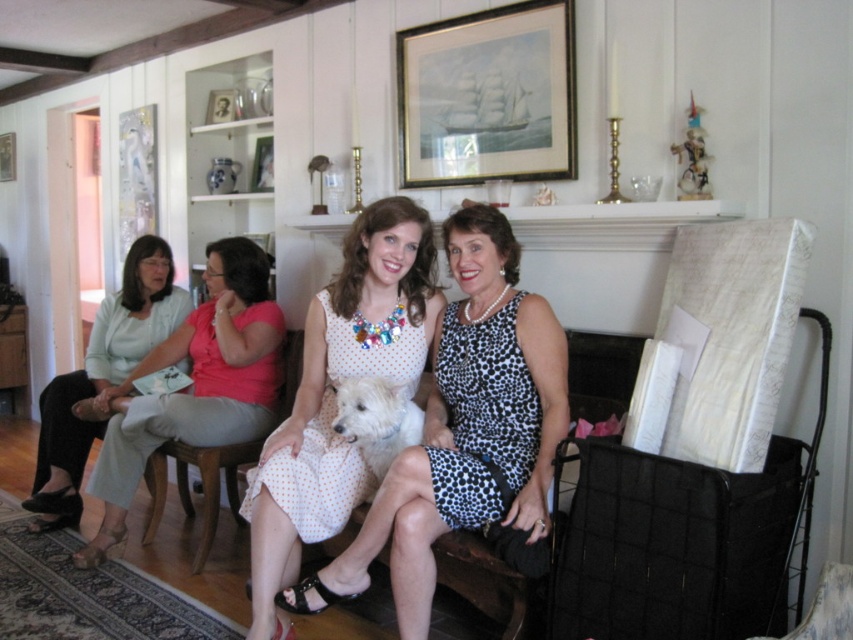
Question: Is white dotted dress at center to the left of white fabric armchair at center from the viewer's perspective?

Choices:
 (A) yes
 (B) no

Answer: (B)

Question: Which of these objects is positioned farthest from the light pink fabric dress at left?

Choices:
 (A) black and white dotted dress at center
 (B) gold-framed print at upper center

Answer: (A)

Question: Can you confirm if white dotted fabric dress at center is positioned to the right of white fur dog at center?

Choices:
 (A) no
 (B) yes

Answer: (A)

Question: Can you confirm if light blue fabric dress at left is positioned to the right of wooden picture frame at upper left?

Choices:
 (A) yes
 (B) no

Answer: (A)

Question: Which object appears closest to the camera in this image?

Choices:
 (A) brushed metal picture frame at upper center
 (B) black and white dotted dress at center

Answer: (B)

Question: Among these objects, which one is farthest from the camera?

Choices:
 (A) brushed metal picture frame at upper center
 (B) light pink fabric dress at left

Answer: (A)